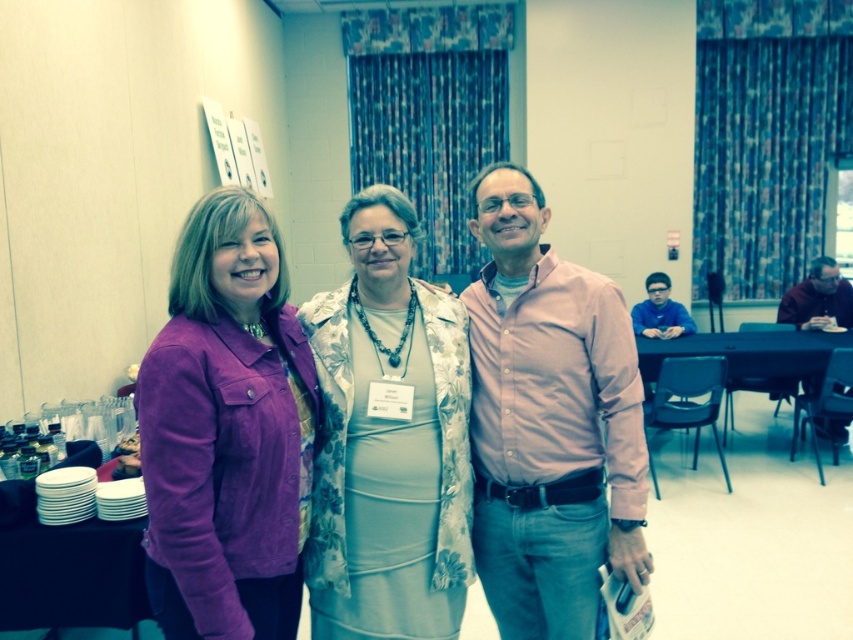
You are a server at a conference and you need to place a drink on the table between the white plastic plates at lower left and the blue matte shirt at center. Where should you place it?

The white plastic plates at lower left is positioned on the left side of blue matte shirt at center, so you should place the drink between them on the right side of the white plastic plates at lower left and the left side of the blue matte shirt at center.

You are a photographer at a conference and need to adjust the lighting so that both the pink cotton shirt at center and the blue matte shirt at center are equally illuminated. Given their distance apart, is this adjustment feasible without moving either shirt?

The pink cotton shirt at center and the blue matte shirt at center are 3.43 meters apart. Since the distance between them is significant, adjusting the lighting to equally illuminate both might require multiple light sources strategically placed around them to cover the entire area. This is feasible if the lighting equipment allows for such adjustments without moving the shirts.

Looking at this image, you are organizing a photo shoot and need to arrange the models in a line from left to right. Given the current positions of the pink cotton shirt at right and the blue matte shirt at center, which one should be placed to the right in the new arrangement?

The pink cotton shirt at right should be placed to the right in the new arrangement because it is already positioned on the right side of the blue matte shirt at center in the current image.